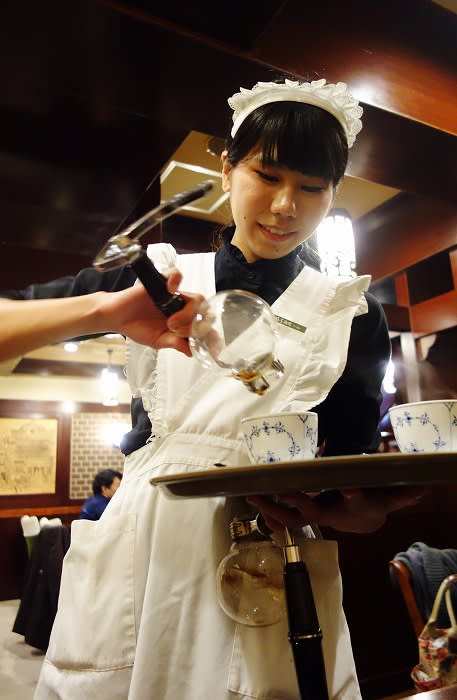
Where is `floor`? The height and width of the screenshot is (700, 457). floor is located at coordinates (27, 666).